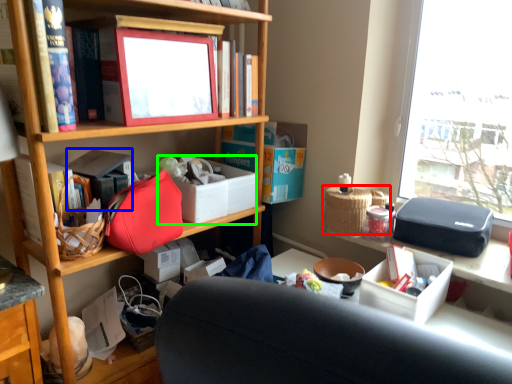
Question: Estimate the real-world distances between objects in this image. Which object is closer to picnic basket (highlighted by a red box), book (highlighted by a blue box) or storage box (highlighted by a green box)?

Choices:
 (A) book
 (B) storage box

Answer: (B)